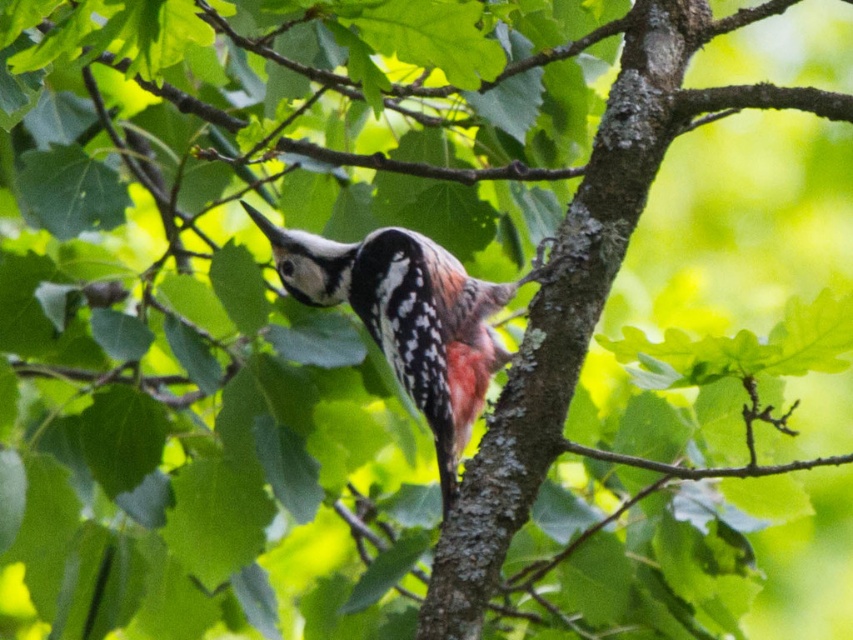
Question: Which point is farther from the camera taking this photo?

Choices:
 (A) (390, 355)
 (B) (532, 444)

Answer: (B)

Question: Is smooth bark tree trunk at center to the left of white speckled woodpecker at center from the viewer's perspective?

Choices:
 (A) yes
 (B) no

Answer: (B)

Question: Which point is closer to the camera taking this photo?

Choices:
 (A) tap(410, 362)
 (B) tap(659, 22)

Answer: (A)

Question: Can you confirm if smooth bark tree trunk at center is thinner than white speckled woodpecker at center?

Choices:
 (A) yes
 (B) no

Answer: (A)

Question: Which of the following is the farthest from the observer?

Choices:
 (A) (433, 284)
 (B) (550, 390)

Answer: (A)

Question: Where is smooth bark tree trunk at center located in relation to white speckled woodpecker at center in the image?

Choices:
 (A) above
 (B) below

Answer: (B)